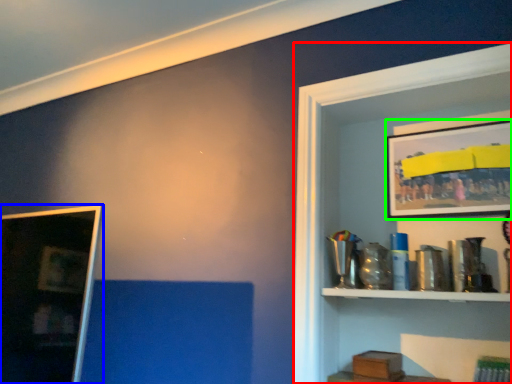
Question: Which object is positioned closest to shelf (highlighted by a red box)? Select from picture frame (highlighted by a blue box) and picture frame (highlighted by a green box).

Choices:
 (A) picture frame
 (B) picture frame

Answer: (B)